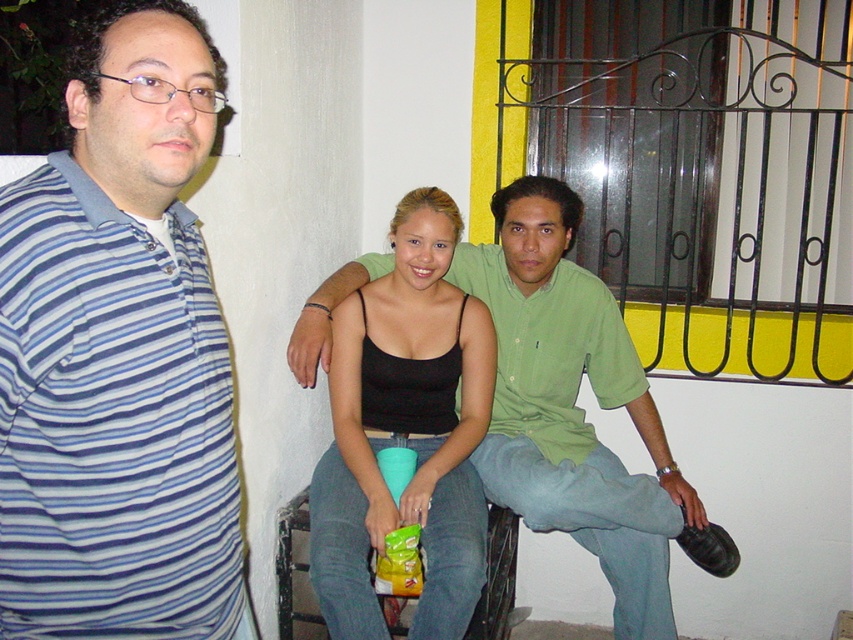
Which is more to the left, blue striped shirt at left or green cotton shirt at center?

blue striped shirt at left is more to the left.

Can you confirm if blue striped shirt at left is thinner than green cotton shirt at center?

Yes.

Between point (215, 444) and point (625, 577), which one is positioned behind?

The point (625, 577) is behind.

Find the location of `blue striped shirt at left`. blue striped shirt at left is located at coordinates (119, 355).

Does blue striped shirt at left come in front of black matte tank top at center?

Yes, blue striped shirt at left is closer to the viewer.

Between point (82, 525) and point (440, 198), which one is positioned behind?

The point (440, 198) is behind.

The width and height of the screenshot is (853, 640). Find the location of `blue striped shirt at left`. blue striped shirt at left is located at coordinates (119, 355).

Does green cotton shirt at center have a larger size compared to black matte tank top at center?

Indeed, green cotton shirt at center has a larger size compared to black matte tank top at center.

Who is positioned more to the left, green cotton shirt at center or black matte tank top at center?

black matte tank top at center is more to the left.

Is point (492, 440) closer to viewer compared to point (358, 339)?

That is False.

Locate an element on the screen. The width and height of the screenshot is (853, 640). green cotton shirt at center is located at coordinates (572, 404).